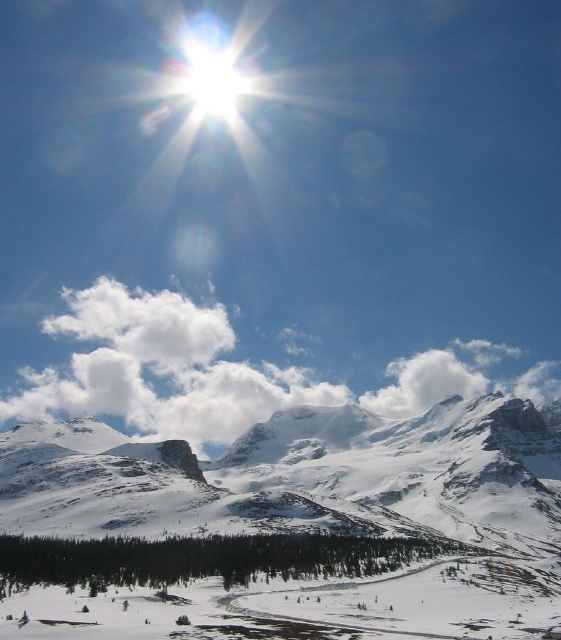
Which is in front, point (342, 476) or point (67, 387)?

Point (342, 476)

Between point (366, 573) and point (186, 406), which one is positioned in front?

Point (366, 573)

Find the location of a particular element. Image resolution: width=561 pixels, height=640 pixels. snowy granite mountain at center is located at coordinates (287, 528).

Describe the element at coordinates (275, 209) in the screenshot. This screenshot has width=561, height=640. I see `bright white snow at upper center` at that location.

Can you confirm if bright white snow at upper center is thinner than snowy granite mountain at center?

No, bright white snow at upper center is not thinner than snowy granite mountain at center.

This screenshot has width=561, height=640. I want to click on bright white snow at upper center, so click(x=275, y=209).

You are a GUI agent. You are given a task and a screenshot of the screen. Output one action in this format:
    pyautogui.click(x=<x>, y=<y>)
    Task: Click on the bright white snow at upper center
    
    Given the screenshot: What is the action you would take?
    pyautogui.click(x=275, y=209)

Between bright white snow at upper center and white fluffy cloud at center, which one appears on the right side from the viewer's perspective?

bright white snow at upper center

Is point (513, 180) less distant than point (415, 385)?

No, (513, 180) is further to viewer.

Between point (327, 330) and point (104, 378), which one is positioned behind?

The point (104, 378) is behind.

What are the coordinates of `bright white snow at upper center` in the screenshot? It's located at (275, 209).